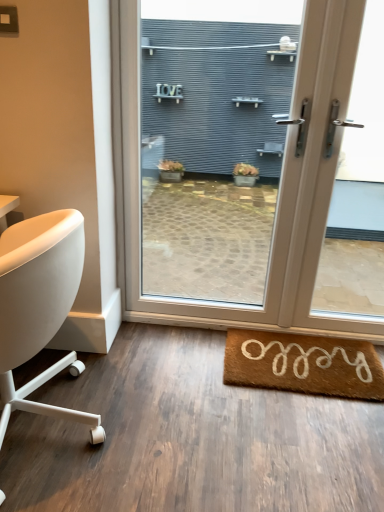
Image resolution: width=384 pixels, height=512 pixels. I want to click on vacant area situated below white leather chair at left (from a real-world perspective), so click(x=53, y=438).